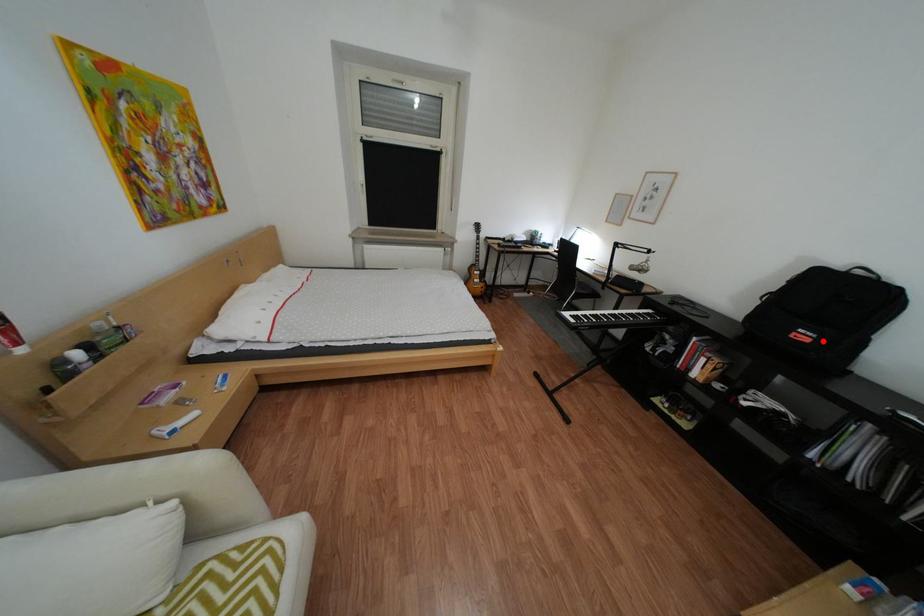
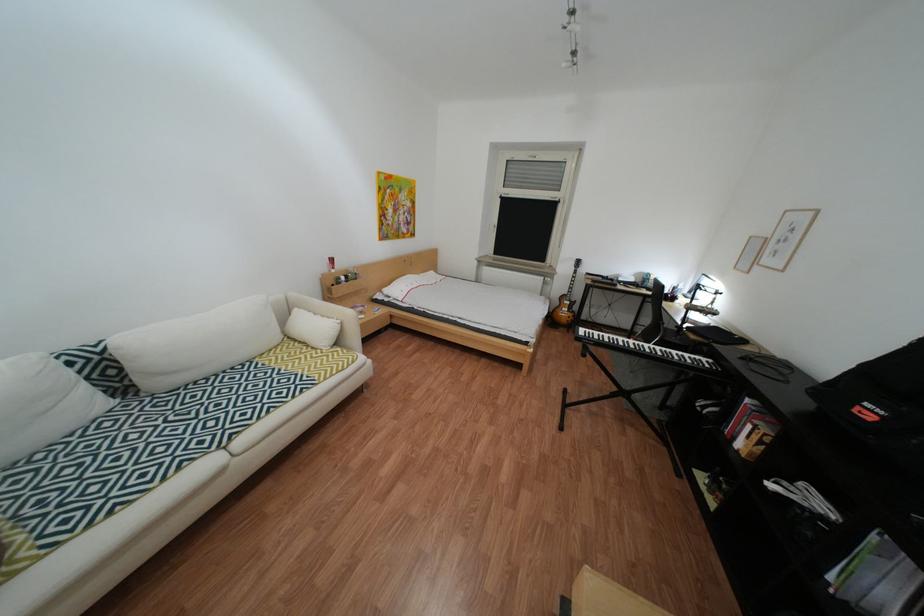
Where in the second image is the point corresponding to the highlighted location from the first image?

(886, 419)